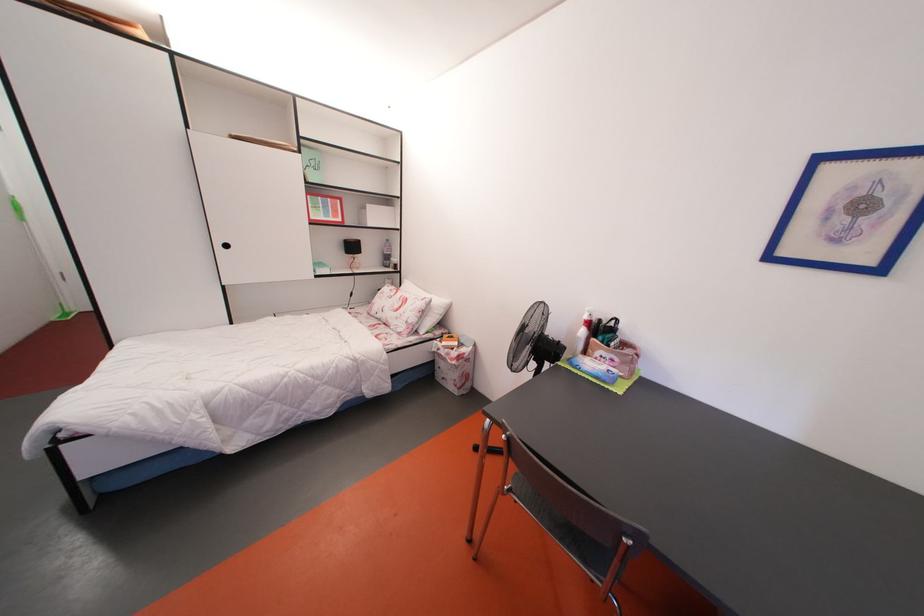
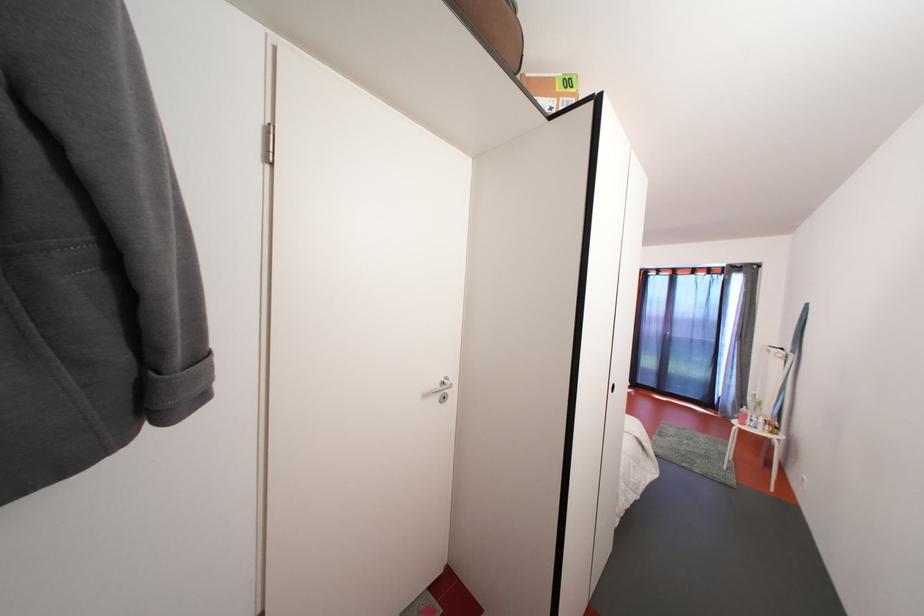
Question: I am providing you with two images of the same scene from different viewpoints. Which of the following objects are not visible in image2?

Choices:
 (A) green spray bottle
 (B) toothbrush charger base
 (C) silver door handle
 (D) black table lamp

Answer: (D)